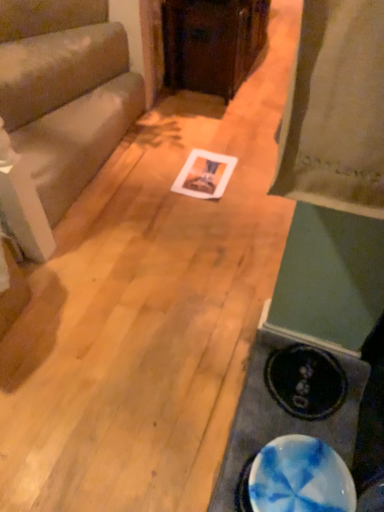
At what (x,y) coordinates should I click in order to perform the action: click on free space in front of wooden cabinet at center, the second furniture in the left-to-right sequence. Please return your answer as a coordinate pair (x, y). The width and height of the screenshot is (384, 512). Looking at the image, I should click on (211, 132).